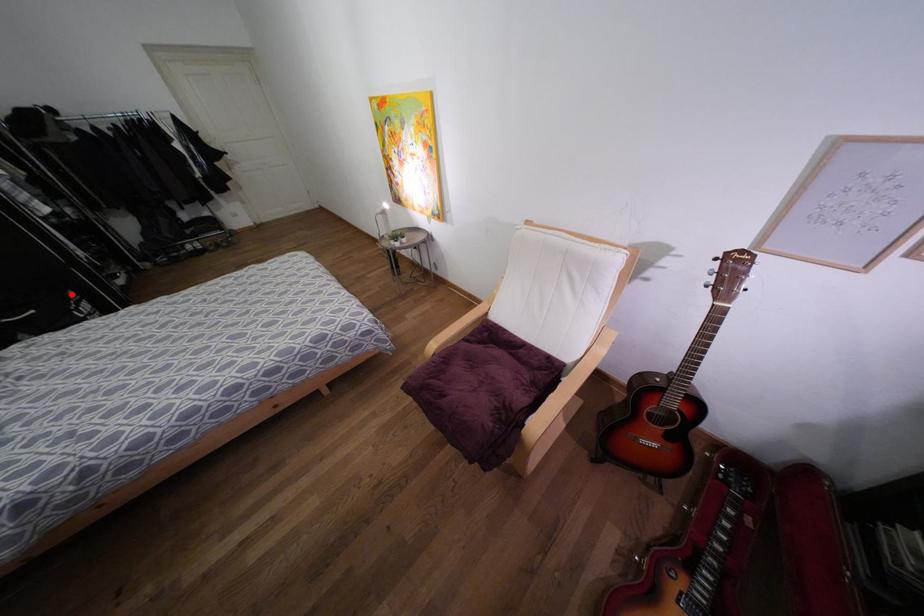
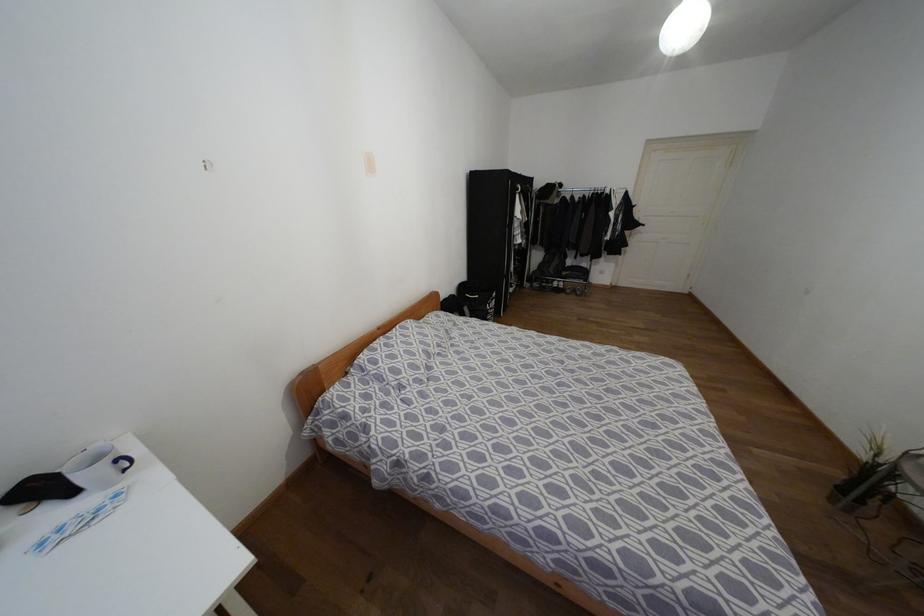
Question: A red point is marked in image1. In image2, is the corresponding 3D point closer to the camera or farther? Reply with the corresponding letter.

Choices:
 (A) The corresponding 3D point is closer.
 (B) The corresponding 3D point is farther.

Answer: (A)